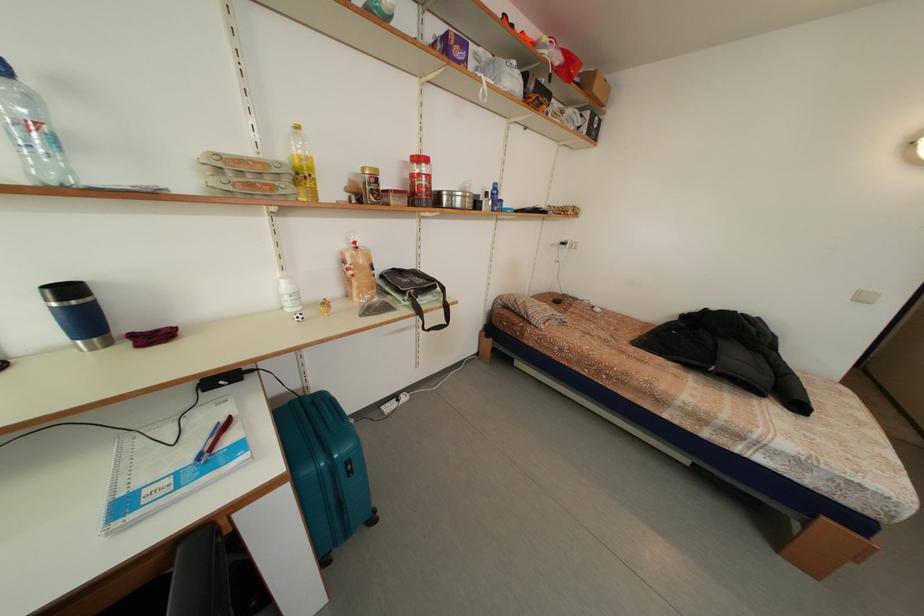
What are the coordinates of `black bag strap` in the screenshot? It's located at pos(417,291).